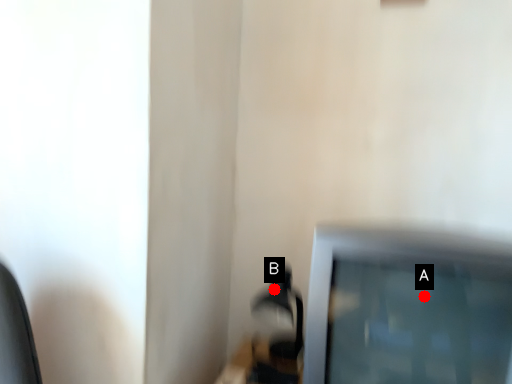
Question: Two points are circled on the image, labeled by A and B beside each circle. Which point is closer to the camera?

Choices:
 (A) A is closer
 (B) B is closer

Answer: (A)